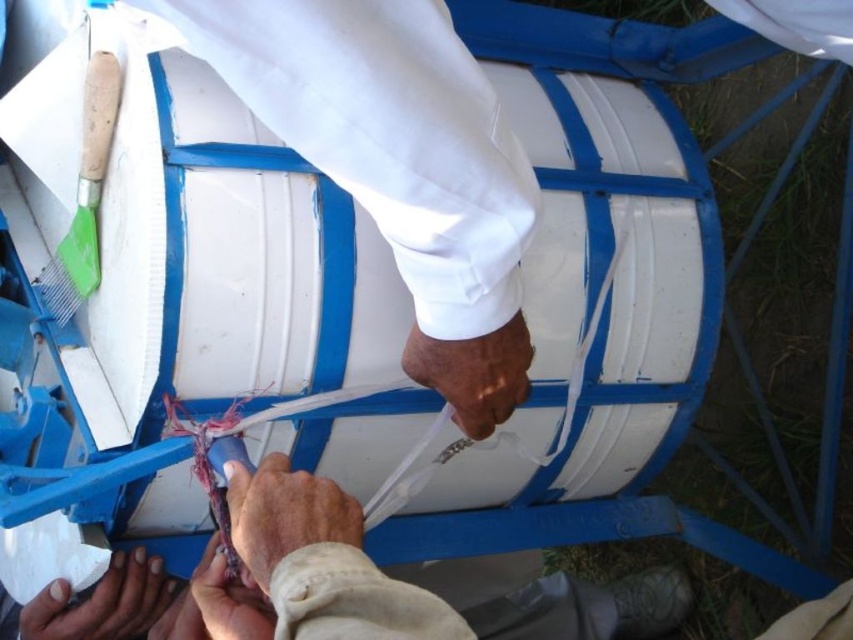
You are an observer looking at the scene. Which hand is closer to you, the brown matte hand at center or the smooth skin hand at lower center?

The brown matte hand at center is closer to you because the smooth skin hand at lower center is behind it.

You are a worker in the field and you need to secure the red and white string around the bucket. There is a dirty white hand at lower left. Where is the dirty white hand located in relation to the bucket?

The dirty white hand at lower left is located at point (102, 602) relative to the bucket.